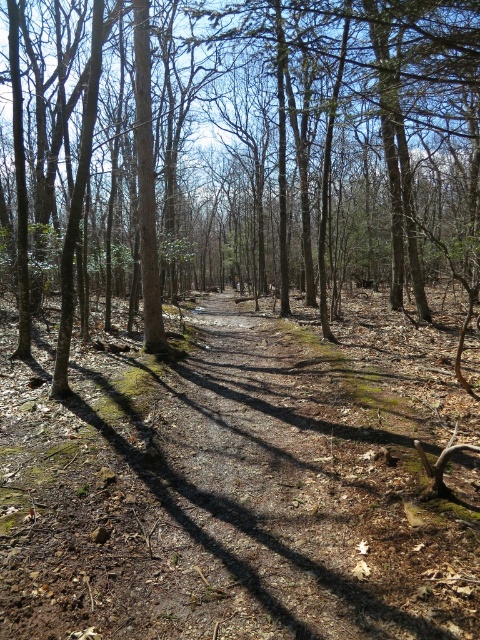
Who is positioned more to the left, brown dirt track at center or brown bark tree at center?

From the viewer's perspective, brown dirt track at center appears more on the left side.

Between point (407, 595) and point (349, 214), which one is positioned in front?

Point (407, 595) is in front.

I want to click on brown dirt track at center, so pyautogui.click(x=240, y=484).